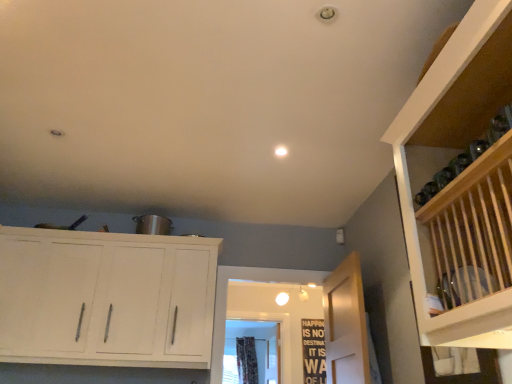
Question: Would you say black wood signboard at center is inside or outside wooden door at center?

Choices:
 (A) outside
 (B) inside

Answer: (A)

Question: From a real-world perspective, is black wood signboard at center positioned above or below wooden door at center?

Choices:
 (A) above
 (B) below

Answer: (A)

Question: Estimate the real-world distances between objects in this image. Which object is farther from the black wood signboard at center?

Choices:
 (A) white wood cabinet at upper left
 (B) wooden door at center
 (C) floral fabric curtain at center

Answer: (A)

Question: Estimate the real-world distances between objects in this image. Which object is farther from the white wood cabinet at upper left?

Choices:
 (A) wooden door at center
 (B) floral fabric curtain at center
 (C) black wood signboard at center

Answer: (B)